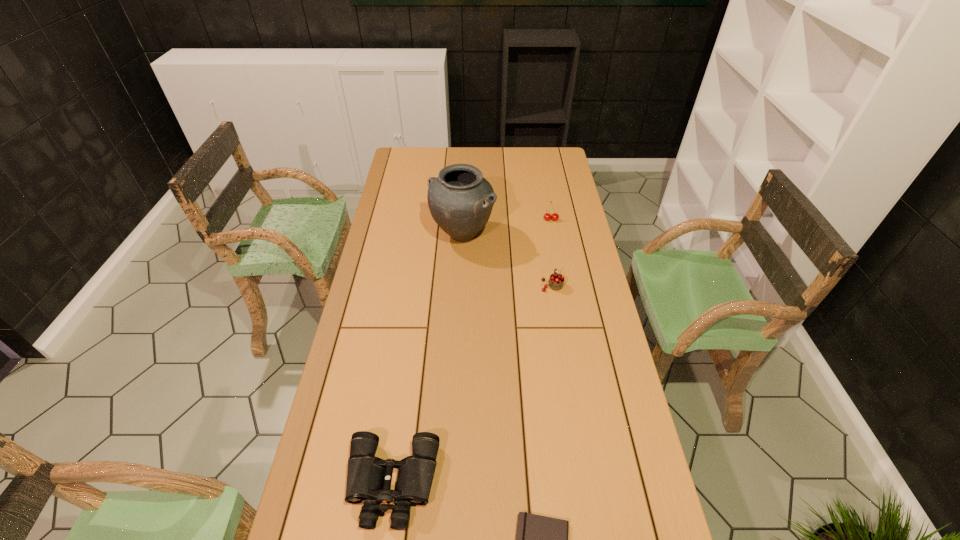
Where is `the tallest object`? This screenshot has width=960, height=540. the tallest object is located at coordinates (460, 200).

Identify the location of the farther cherry. The image size is (960, 540). (547, 216).

Locate an element on the screen. This screenshot has height=540, width=960. the third farthest object is located at coordinates 556,281.

Locate an element on the screen. This screenshot has height=540, width=960. binoculars is located at coordinates (365, 474).

Where is `free region located on the right of the urn`? The image size is (960, 540). free region located on the right of the urn is located at coordinates (515, 234).

In order to click on vacant space located 0.360m with the stems of the farther cherry pointing upwards in this screenshot , I will do `click(563, 282)`.

The height and width of the screenshot is (540, 960). Identify the location of free space located 0.400m on the handle side of the third farthest object. (540, 212).

At what (x,y) coordinates should I click in order to perform the action: click on vacant space located on the handle side of the third farthest object. Please return your answer as a coordinate pair (x, y). Looking at the image, I should click on (542, 228).

I want to click on free space located on the handle side of the third farthest object, so click(x=540, y=214).

Locate an element on the screen. The image size is (960, 540). object situated at the left edge is located at coordinates (365, 474).